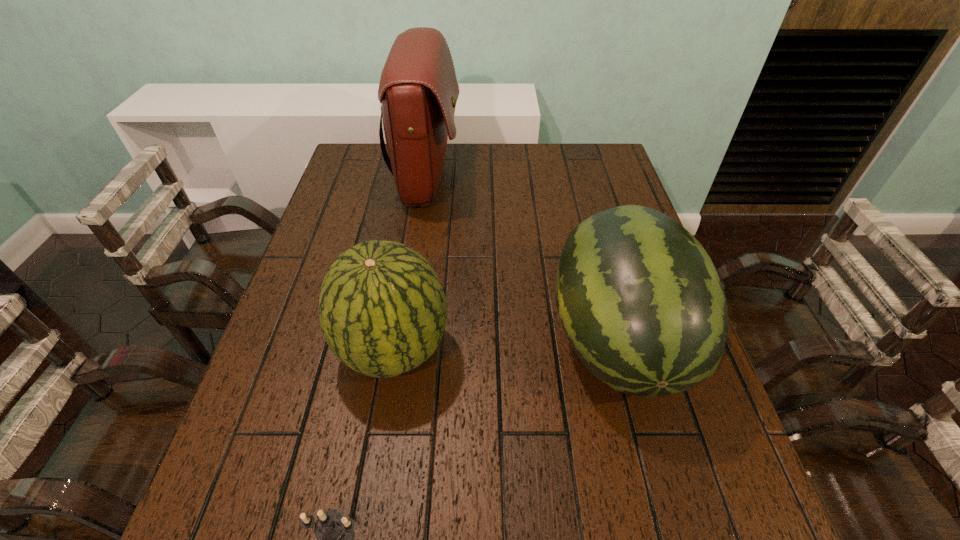
Identify the location of vacant space at the far edge. (508, 166).

This screenshot has width=960, height=540. In the image, there is a desktop. In order to click on vacant space at the near edge in this screenshot , I will do `click(638, 537)`.

The height and width of the screenshot is (540, 960). In the image, there is a desktop. Identify the location of free space at the left edge. (324, 245).

In the image, there is a desktop. Where is `vacant region at the right edge`? Image resolution: width=960 pixels, height=540 pixels. vacant region at the right edge is located at coordinates (586, 202).

Where is `vacant area that lies between the left watermelon and the right watermelon`? vacant area that lies between the left watermelon and the right watermelon is located at coordinates (506, 345).

Where is `free space between the right watermelon and the tallest object`? This screenshot has height=540, width=960. free space between the right watermelon and the tallest object is located at coordinates (522, 259).

Find the location of a particular element. unoccupied position between the left watermelon and the right watermelon is located at coordinates (506, 345).

You are a GUI agent. You are given a task and a screenshot of the screen. Output one action in this format:
    pyautogui.click(x=<x>, y=<y>)
    Task: Click on the vacant space that's between the left watermelon and the right watermelon
    The width and height of the screenshot is (960, 540).
    Given the screenshot: What is the action you would take?
    pyautogui.click(x=506, y=345)

Where is `vacant region between the farthest object and the right watermelon`? This screenshot has height=540, width=960. vacant region between the farthest object and the right watermelon is located at coordinates (522, 259).

Find the location of a particular element. The image size is (960, 540). free area in between the satchel and the right watermelon is located at coordinates (522, 259).